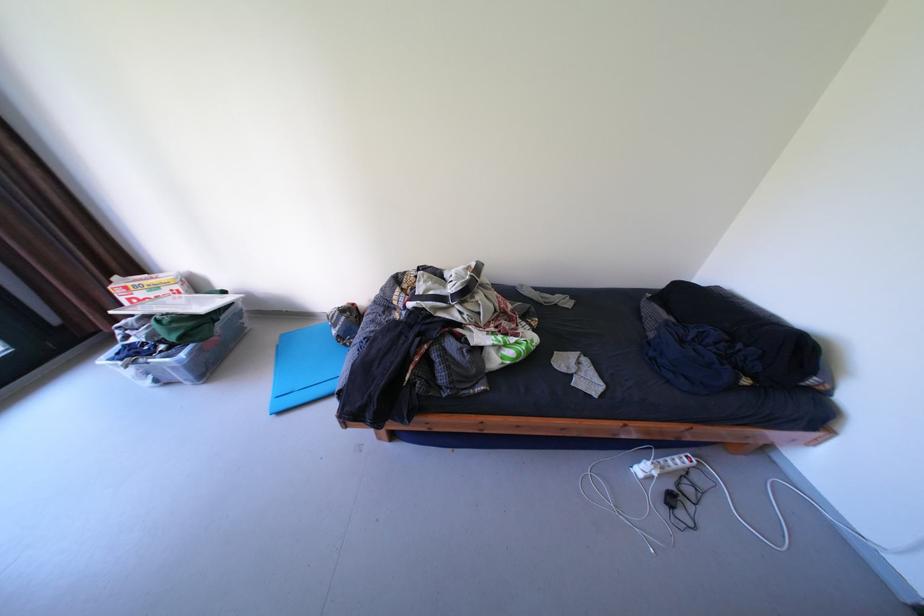
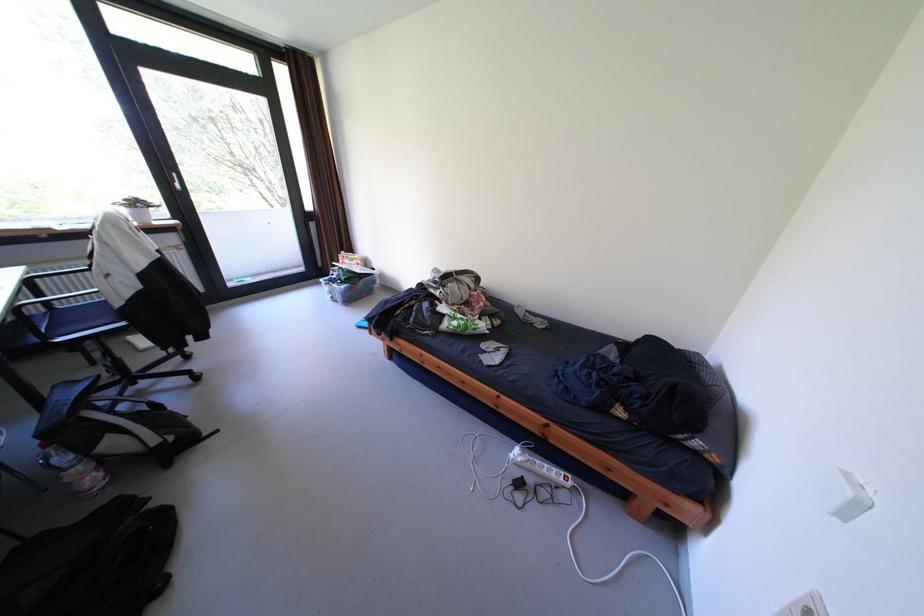
Find the pixel in the second image that matches point 520,306 in the first image.

(492, 304)